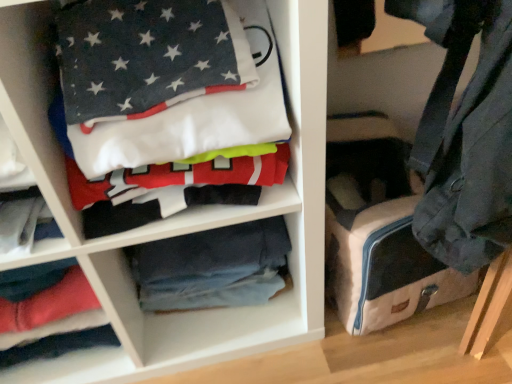
Where is `free point above blue denim jeans at center (from a real-world perspective)`? The height and width of the screenshot is (384, 512). free point above blue denim jeans at center (from a real-world perspective) is located at coordinates (214, 237).